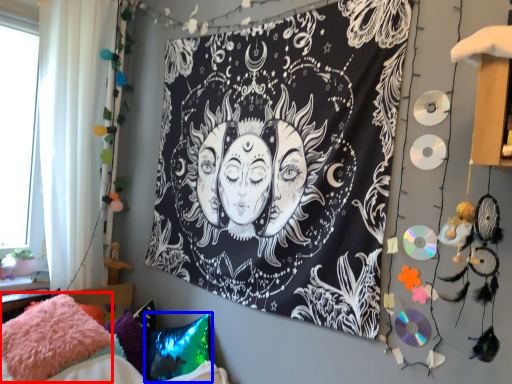
Question: Which object appears farthest to the camera in this image, pillow (highlighted by a red box) or pillow (highlighted by a blue box)?

Choices:
 (A) pillow
 (B) pillow

Answer: (B)